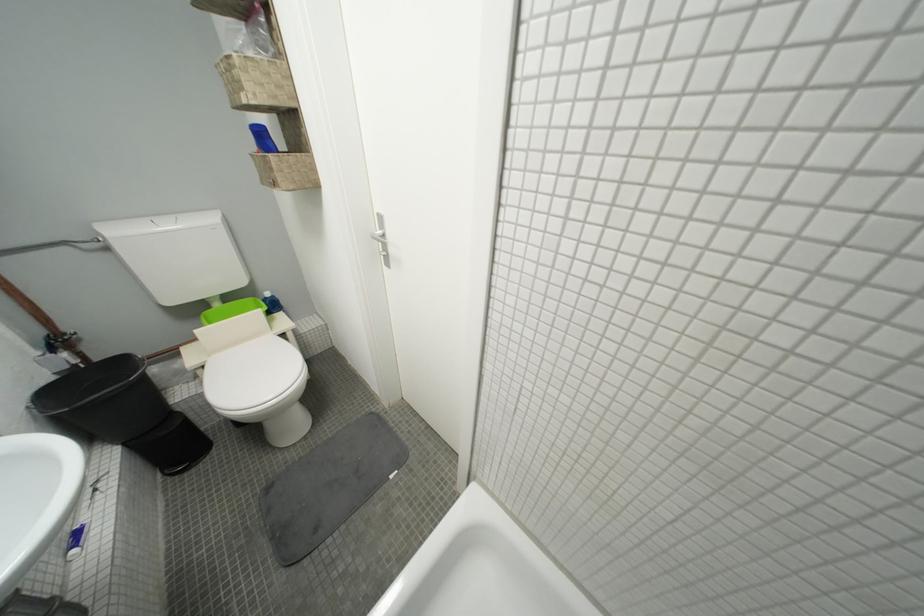
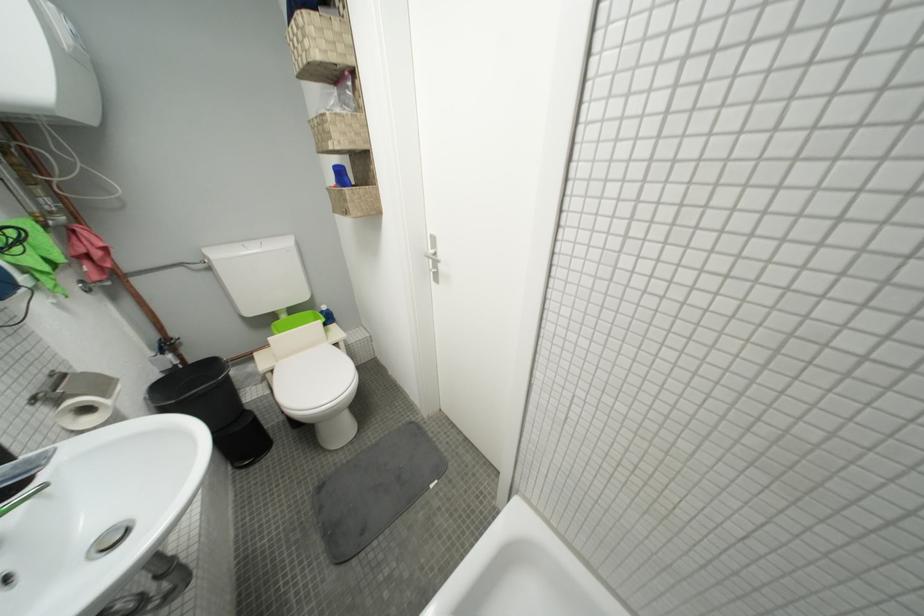
Locate, in the second image, the point that corresponds to point (213, 370) in the first image.

(281, 373)